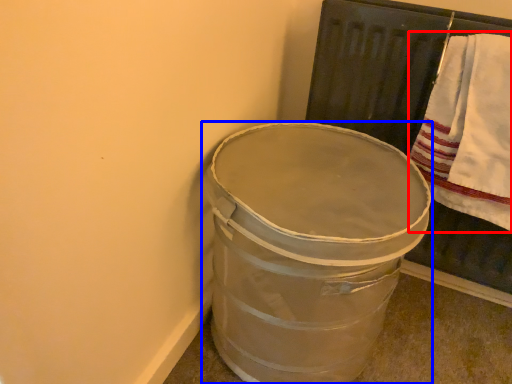
Question: Which object appears closest to the camera in this image, bath towel (highlighted by a red box) or waste container (highlighted by a blue box)?

Choices:
 (A) bath towel
 (B) waste container

Answer: (B)